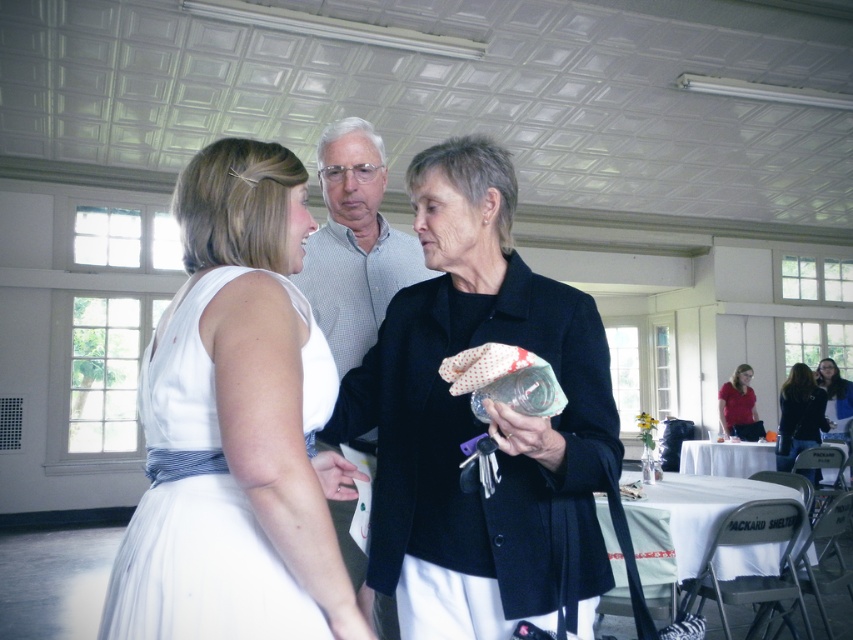
Question: Does white checkered shirt at center appear over black fabric purse at center?

Choices:
 (A) no
 (B) yes

Answer: (B)

Question: Which of the following is the farthest from the observer?

Choices:
 (A) white tulle dress at center
 (B) matte black jacket at center

Answer: (B)

Question: Can you confirm if white checkered shirt at center is bigger than blue fabric jacket at upper right?

Choices:
 (A) no
 (B) yes

Answer: (B)

Question: Among these objects, which one is nearest to the camera?

Choices:
 (A) matte red shirt at center
 (B) black fabric purse at center

Answer: (B)

Question: Which point is closer to the camera?

Choices:
 (A) (840, 403)
 (B) (383, 557)
 (C) (335, 122)
 (D) (759, 419)

Answer: (B)

Question: Considering the relative positions of white checkered shirt at center and black fabric purse at center in the image provided, where is white checkered shirt at center located with respect to black fabric purse at center?

Choices:
 (A) left
 (B) right

Answer: (A)